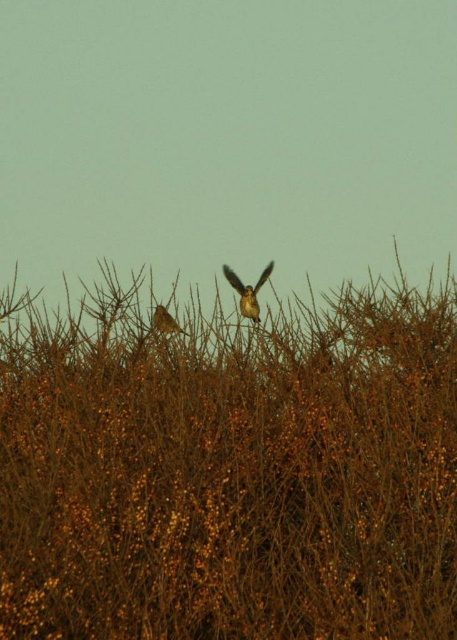
Question: Can you confirm if brown textured hedge at center is smaller than brown textured bird at center?

Choices:
 (A) yes
 (B) no

Answer: (B)

Question: Is brown textured hedge at center further to camera compared to brown speckled feathers at center?

Choices:
 (A) no
 (B) yes

Answer: (A)

Question: Observing the image, what is the correct spatial positioning of brown textured hedge at center in reference to brown textured bird at center?

Choices:
 (A) above
 (B) below

Answer: (B)

Question: Which of these objects is positioned farthest from the brown speckled feathers at center?

Choices:
 (A) brown textured hedge at center
 (B) brown textured bird at center

Answer: (A)

Question: Which object is the farthest from the brown speckled feathers at center?

Choices:
 (A) brown textured hedge at center
 (B) brown textured bird at center

Answer: (A)

Question: Which object is farther from the camera taking this photo?

Choices:
 (A) brown textured bird at center
 (B) brown textured hedge at center
 (C) brown speckled feathers at center

Answer: (C)